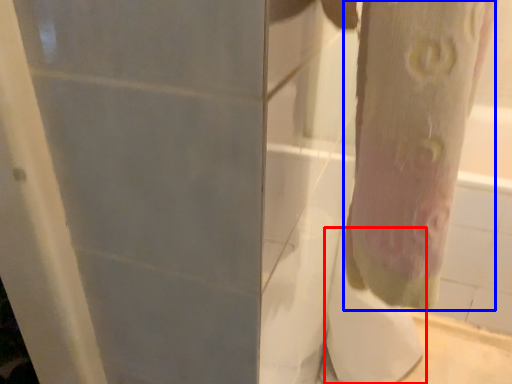
Question: Which object is further to the camera taking this photo, toilet paper (highlighted by a red box) or tree trunk (highlighted by a blue box)?

Choices:
 (A) toilet paper
 (B) tree trunk

Answer: (A)